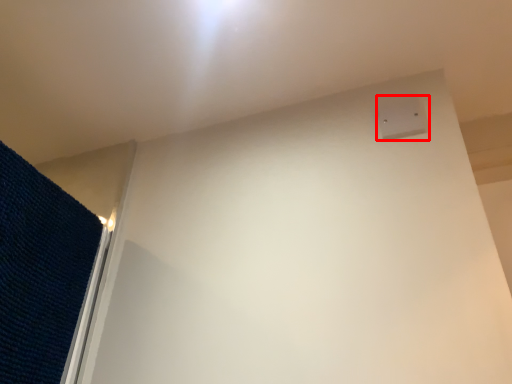
Question: Observing the image, what is the correct spatial positioning of electric outlet (annotated by the red box) in reference to mat?

Choices:
 (A) left
 (B) right

Answer: (B)